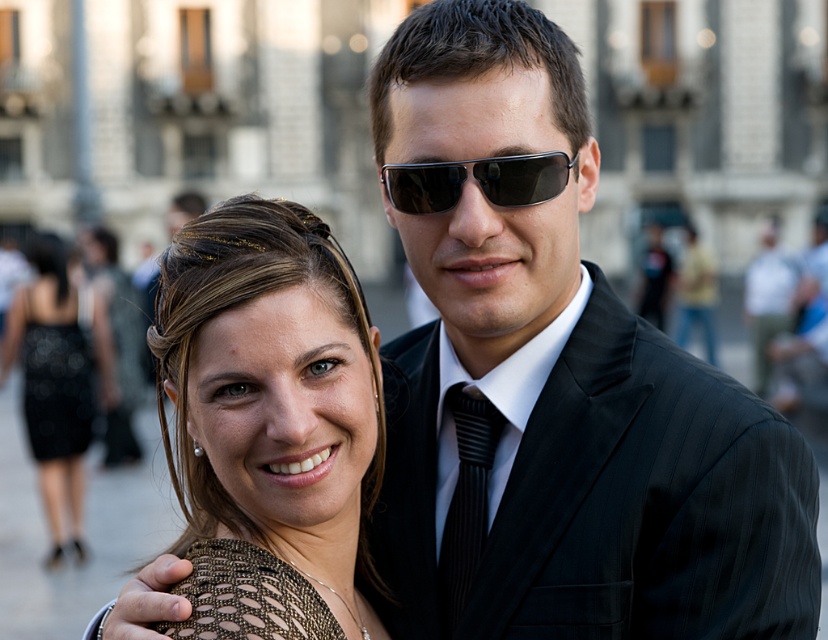
Based on the scene description, where is the black pinstripe suit at center located in the image?

The black pinstripe suit at center is located at point (648, 500) in the image.

You are a photographer setting up for a photoshoot in a plaza. You need to ensure that the black pinstripe suit at center and the satin black dress at lower left are both visible in the frame. Based on their positions, which object is lower in the image?

The black pinstripe suit at center is positioned under the satin black dress at lower left, so the black pinstripe suit at center is lower in the image.

You are a photographer trying to capture a group photo of the black pinstripe suit at center and the matte gold hair at center. The camera you are using has a maximum focus range of 8 meters. Can you fit both subjects within the camera focus range so they are both in focus?

The black pinstripe suit at center and matte gold hair at center are 7.81 meters apart from each other. Since the camera has a maximum focus range of 8 meters, the distance between them is within the limit. Therefore, both subjects can be in focus simultaneously.